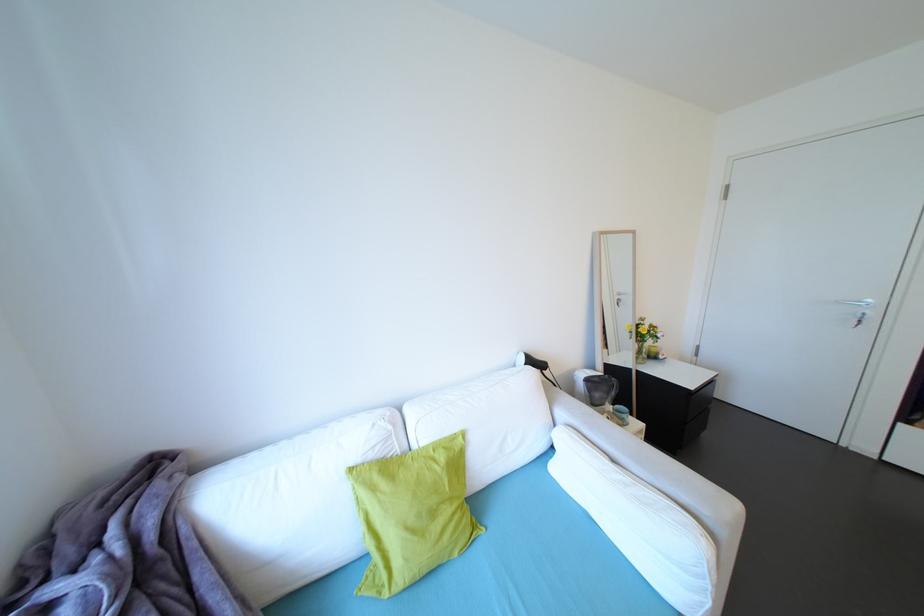
What do you see at coordinates (636, 515) in the screenshot? I see `the white pillow` at bounding box center [636, 515].